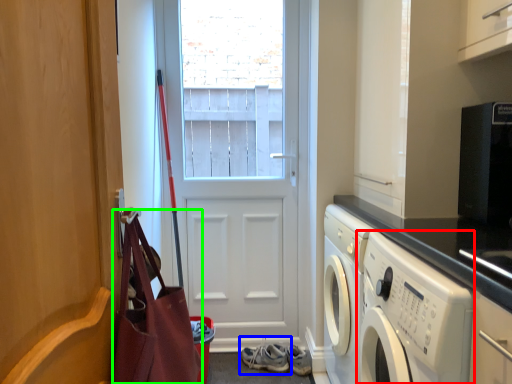
Question: Based on their relative distances, which object is nearer to washing machine (highlighted by a red box)? Choose from footwear (highlighted by a blue box) and bag (highlighted by a green box).

Choices:
 (A) footwear
 (B) bag

Answer: (B)